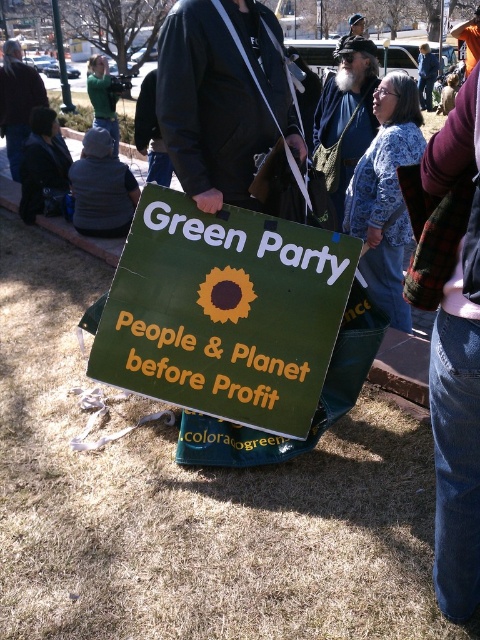
Between black leather jacket at center and gray fleece jacket at left, which one is positioned lower?

black leather jacket at center is below.

Between black leather jacket at center and gray fleece jacket at left, which one has less height?

With less height is black leather jacket at center.

Find the location of a particular element. The image size is (480, 640). black leather jacket at center is located at coordinates (222, 99).

Which is more to the left, bearded man with hat at upper center or dark gray jacket at upper left?

Positioned to the left is dark gray jacket at upper left.

Between point (314, 116) and point (17, 92), which one is positioned in front?

Point (314, 116) is in front.

Where is `bearded man with hat at upper center`? This screenshot has width=480, height=640. bearded man with hat at upper center is located at coordinates (347, 113).

Can you confirm if gray fleece jacket at left is thinner than dark gray jacket at upper left?

Yes.

Does gray fleece jacket at left have a greater width compared to dark gray jacket at upper left?

No, gray fleece jacket at left is not wider than dark gray jacket at upper left.

The height and width of the screenshot is (640, 480). Describe the element at coordinates (101, 188) in the screenshot. I see `gray fleece jacket at left` at that location.

The height and width of the screenshot is (640, 480). In order to click on gray fleece jacket at left in this screenshot , I will do `click(101, 188)`.